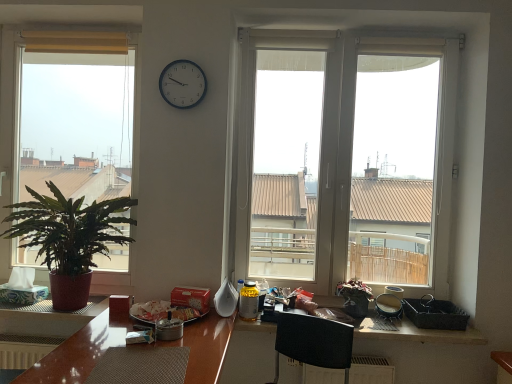
Where is `free space above white plastic window at center, positioned as the 1th window in right-to-left order (from a real-world perspective)`? The image size is (512, 384). free space above white plastic window at center, positioned as the 1th window in right-to-left order (from a real-world perspective) is located at coordinates 381,28.